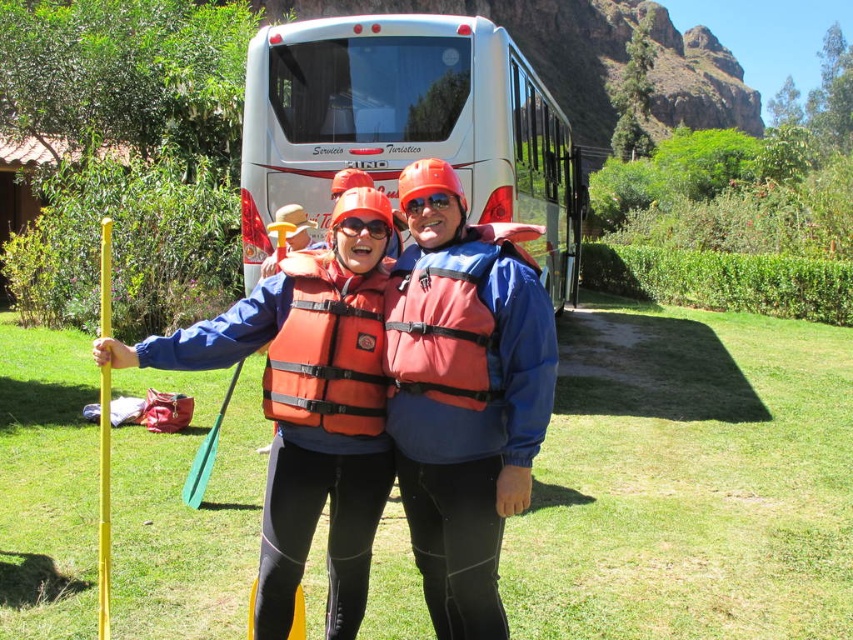
Question: Which object appears farthest from the camera in this image?

Choices:
 (A) white glossy bus at center
 (B) transparent plastic goggles at center
 (C) orange life vest at center
 (D) orange nylon life jacket at center

Answer: (A)

Question: Which object is farther from the camera taking this photo?

Choices:
 (A) matte orange life vest at center
 (B) transparent plastic goggles at center
 (C) orange life jacket at center
 (D) orange nylon life jacket at center

Answer: (B)

Question: Which object is closer to the camera taking this photo?

Choices:
 (A) orange life jacket at center
 (B) white glossy bus at center
 (C) orange matte goggles at center
 (D) transparent plastic goggles at center

Answer: (A)

Question: Is orange life vest at center bigger than orange life jacket at center?

Choices:
 (A) no
 (B) yes

Answer: (B)

Question: Can you confirm if matte orange life vest at center is positioned below orange life jacket at center?

Choices:
 (A) no
 (B) yes

Answer: (B)

Question: Considering the relative positions of orange life vest at center and transparent plastic goggles at center in the image provided, where is orange life vest at center located with respect to transparent plastic goggles at center?

Choices:
 (A) right
 (B) left

Answer: (B)